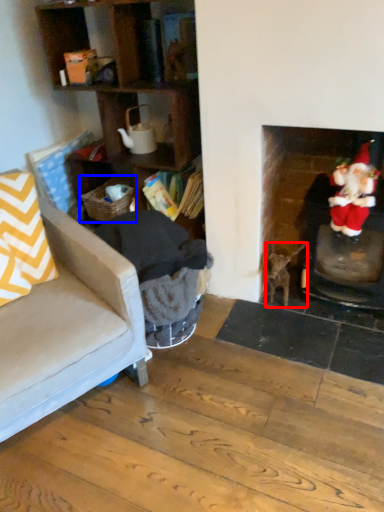
Question: Which point is further to the camera, animal (highlighted by a red box) or laundry basket (highlighted by a blue box)?

Choices:
 (A) animal
 (B) laundry basket

Answer: (B)